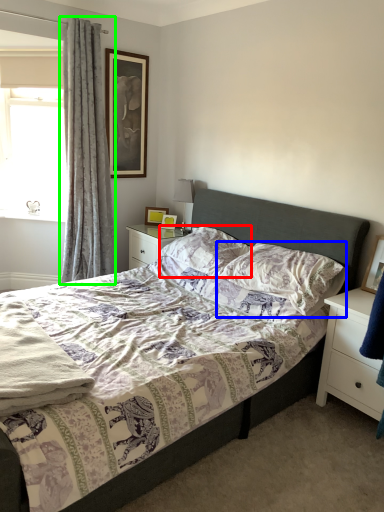
Question: Considering the real-world distances, which object is farthest from pillow (highlighted by a red box)? pillow (highlighted by a blue box) or curtain (highlighted by a green box)?

Choices:
 (A) pillow
 (B) curtain

Answer: (B)